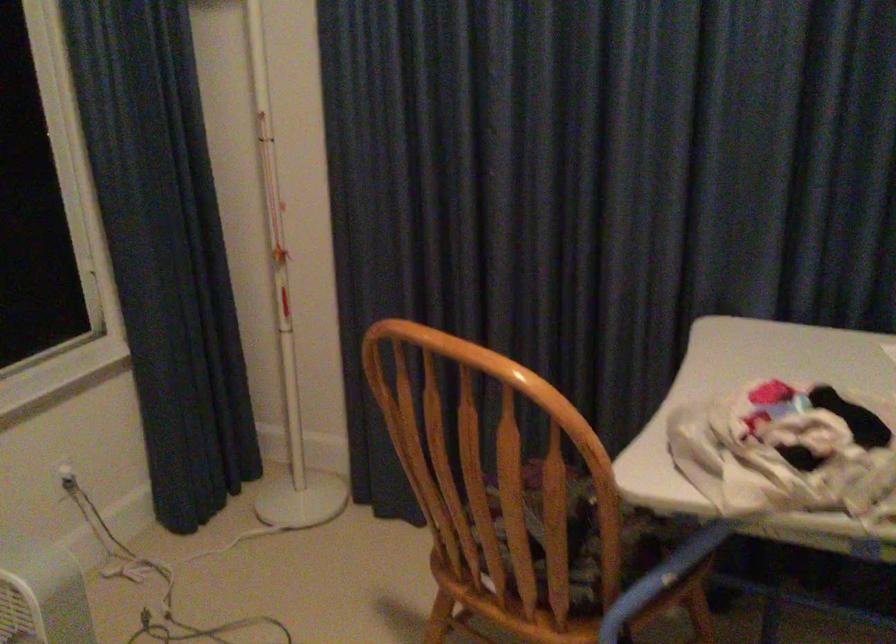
The height and width of the screenshot is (644, 896). What do you see at coordinates (164, 581) in the screenshot? I see `the lamp pull chain` at bounding box center [164, 581].